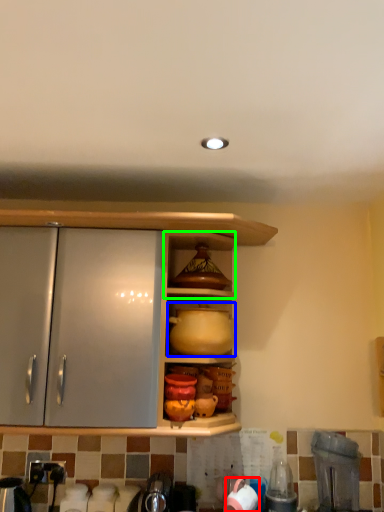
Question: Based on their relative distances, which object is nearer to tableware (highlighted by a red box)? Choose from pottery (highlighted by a blue box) and shelf (highlighted by a green box).

Choices:
 (A) pottery
 (B) shelf

Answer: (A)